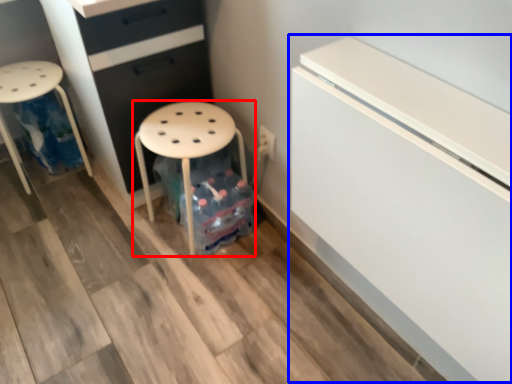
Question: Which object is further to the camera taking this photo, stool (highlighted by a red box) or fridge (highlighted by a blue box)?

Choices:
 (A) stool
 (B) fridge

Answer: (A)